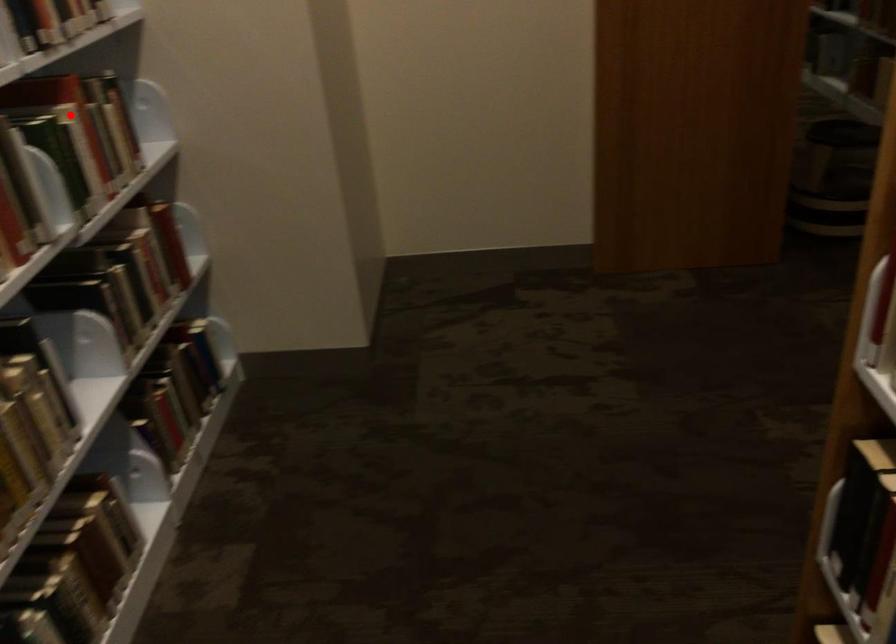
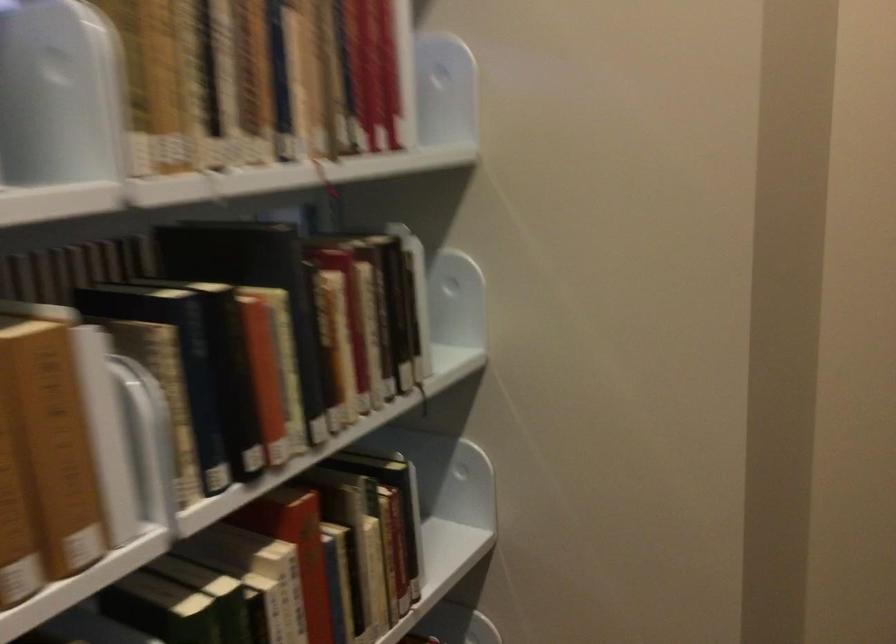
Question: I am providing you with two images of the same scene from different viewpoints. Given a red point in image1, look at the same physical point in image2. Is it:

Choices:
 (A) Closer to the viewpoint
 (B) Farther from the viewpoint

Answer: (A)